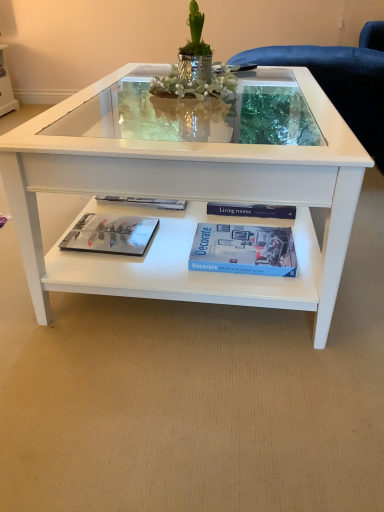
Question: Is white glossy coffee table at center not close to blue matte book at center?

Choices:
 (A) no
 (B) yes

Answer: (A)

Question: Is white glossy coffee table at center taller than blue matte book at center?

Choices:
 (A) no
 (B) yes

Answer: (B)

Question: From a real-world perspective, is white glossy coffee table at center located beneath blue matte book at center?

Choices:
 (A) no
 (B) yes

Answer: (A)

Question: Is white glossy coffee table at center smaller than blue matte book at center?

Choices:
 (A) no
 (B) yes

Answer: (A)

Question: Is blue matte book at center completely or partially inside white glossy coffee table at center?

Choices:
 (A) yes
 (B) no

Answer: (A)

Question: Is white glossy coffee table at center closer to camera compared to blue matte book at center?

Choices:
 (A) yes
 (B) no

Answer: (A)

Question: Is matte glossy magazine at lower left located outside white glossy coffee table at center?

Choices:
 (A) no
 (B) yes

Answer: (B)

Question: Is matte glossy magazine at lower left turned away from white glossy coffee table at center?

Choices:
 (A) no
 (B) yes

Answer: (B)

Question: Is matte glossy magazine at lower left to the left of white glossy coffee table at center from the viewer's perspective?

Choices:
 (A) no
 (B) yes

Answer: (B)

Question: Is matte glossy magazine at lower left far away from white glossy coffee table at center?

Choices:
 (A) no
 (B) yes

Answer: (A)

Question: Does matte glossy magazine at lower left touch white glossy coffee table at center?

Choices:
 (A) no
 (B) yes

Answer: (A)

Question: Can you confirm if matte glossy magazine at lower left is positioned to the right of white glossy coffee table at center?

Choices:
 (A) no
 (B) yes

Answer: (A)

Question: Considering the relative sizes of matte glossy magazine at lower left and blue matte book at center in the image provided, is matte glossy magazine at lower left bigger than blue matte book at center?

Choices:
 (A) yes
 (B) no

Answer: (B)